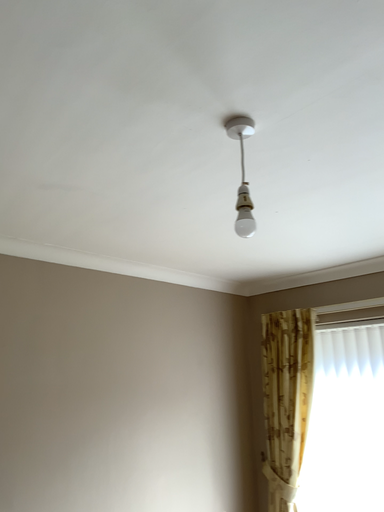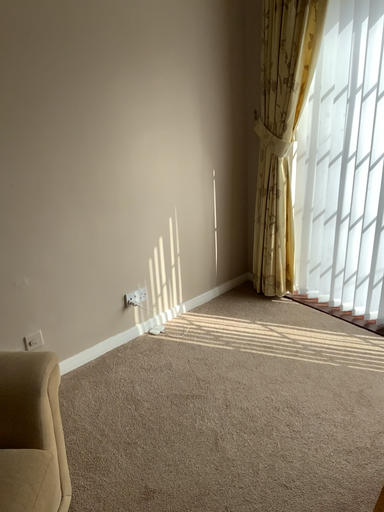
Question: Which way did the camera rotate in the video?

Choices:
 (A) rotated downward
 (B) rotated upward

Answer: (A)